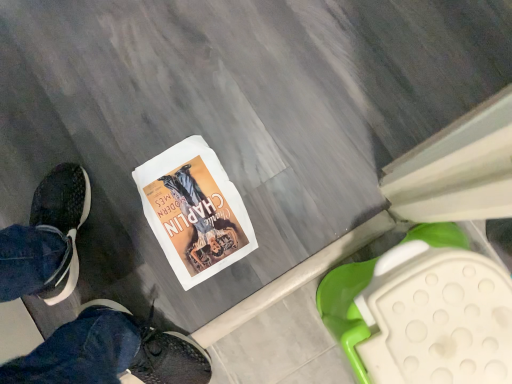
The height and width of the screenshot is (384, 512). I want to click on vacant space in white paper comic book at center (from a real-world perspective), so click(192, 214).